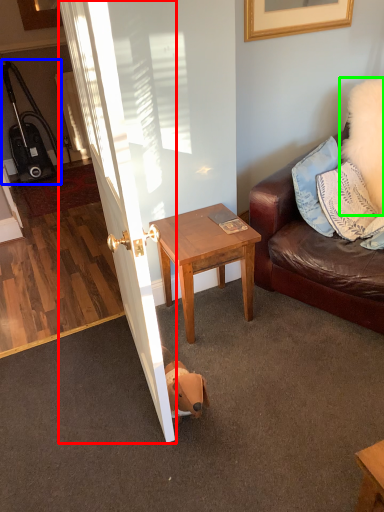
Question: Which object is positioned closest to door (highlighted by a red box)? Select from luggage (highlighted by a blue box) and pillow (highlighted by a green box).

Choices:
 (A) luggage
 (B) pillow

Answer: (B)